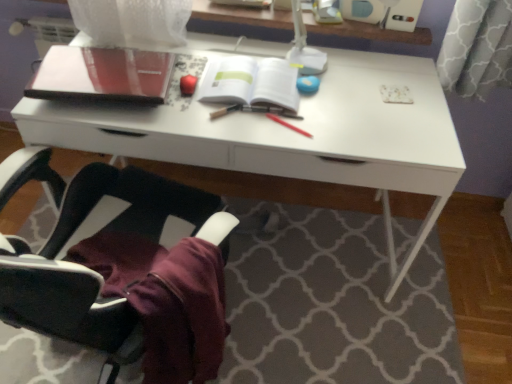
Identify the location of vacant space that's between matte black notebook at upper left and white paper at center. (202, 94).